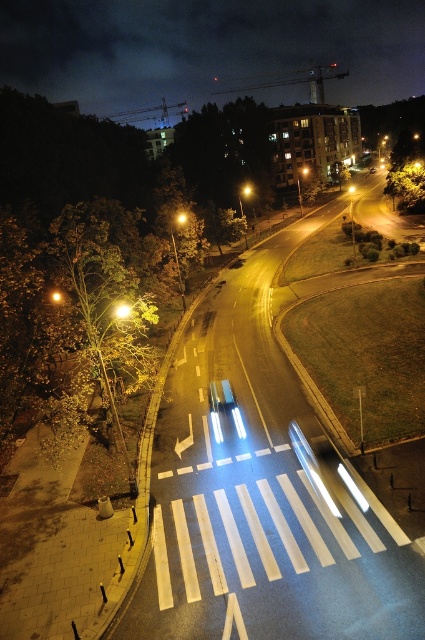
Question: Is bright yellow streetlight at upper center positioned before yellow plastic traffic light at center?

Choices:
 (A) no
 (B) yes

Answer: (B)

Question: Which object is farther from the camera taking this photo?

Choices:
 (A) yellow plastic traffic light at center
 (B) metallic streetlight at upper left

Answer: (A)

Question: In this image, where is metallic streetlight at upper left located relative to yellow/transparent traffic light at center?

Choices:
 (A) below
 (B) above

Answer: (A)

Question: Can you confirm if metallic streetlight at upper left is smaller than yellowish glass traffic light at center?

Choices:
 (A) yes
 (B) no

Answer: (B)

Question: Which of the following is the closest to the observer?

Choices:
 (A) (333, 65)
 (B) (351, 186)
 (C) (181, 220)
 (D) (119, 316)

Answer: (D)

Question: Which point is closer to the camera?

Choices:
 (A) yellow/transparent traffic light at center
 (B) yellowish glass traffic light at center
 (C) yellow matte streetlight at center

Answer: (B)